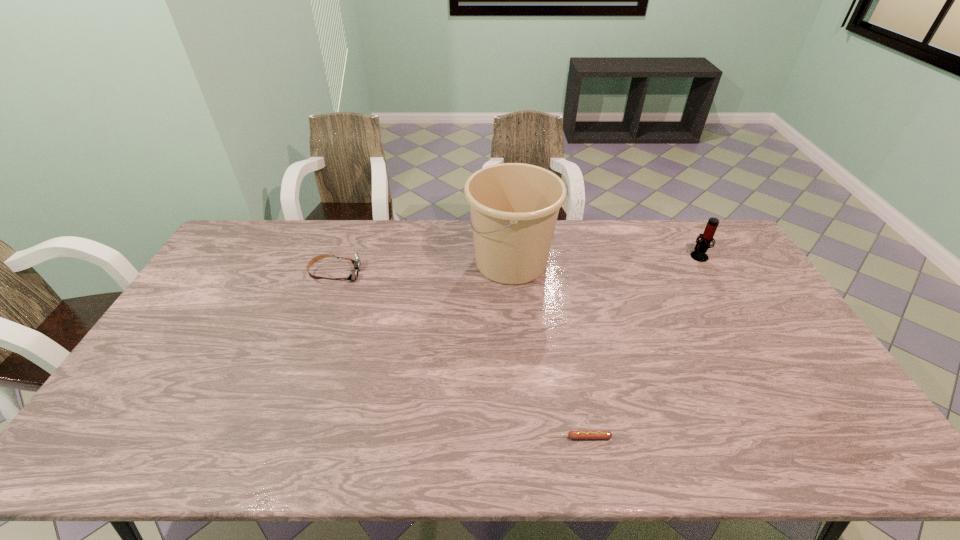
In order to click on object that is the closest to the leftmost object in this screenshot , I will do `click(514, 207)`.

You are a GUI agent. You are given a task and a screenshot of the screen. Output one action in this format:
    pyautogui.click(x=<x>, y=<y>)
    Task: Click on the free spot that satisfies the following two spatial constraints: 1. on the front side of the nearest object; 2. on the left side of the tallest object
    
    Given the screenshot: What is the action you would take?
    pyautogui.click(x=525, y=437)

In order to click on free location that satisfies the following two spatial constraints: 1. on the back side of the bucket; 2. on the right side of the microphone in this screenshot , I will do `click(511, 255)`.

Locate an element on the screen. This screenshot has height=540, width=960. free space that satisfies the following two spatial constraints: 1. on the front-facing side of the shortest object; 2. on the left side of the third tallest object is located at coordinates (275, 437).

At what (x,y) coordinates should I click in order to perform the action: click on free space that satisfies the following two spatial constraints: 1. on the front-facing side of the leftmost object; 2. on the left side of the shortest object. Please return your answer as a coordinate pair (x, y). The height and width of the screenshot is (540, 960). Looking at the image, I should click on (275, 437).

You are a GUI agent. You are given a task and a screenshot of the screen. Output one action in this format:
    pyautogui.click(x=<x>, y=<y>)
    Task: Click on the free location that satisfies the following two spatial constraints: 1. on the front-facing side of the nearest object; 2. on the right side of the second shortest object
    The image size is (960, 540).
    Given the screenshot: What is the action you would take?
    pyautogui.click(x=275, y=437)